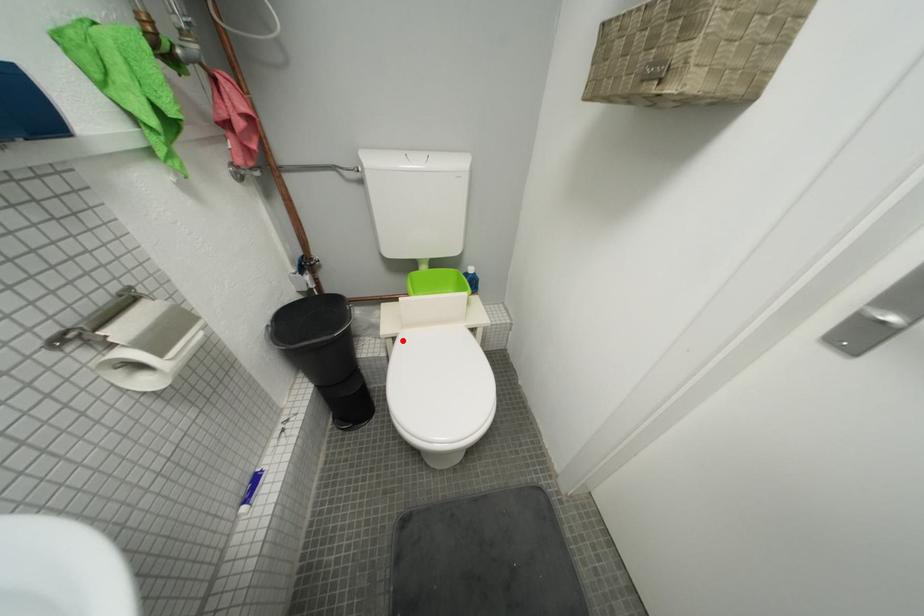
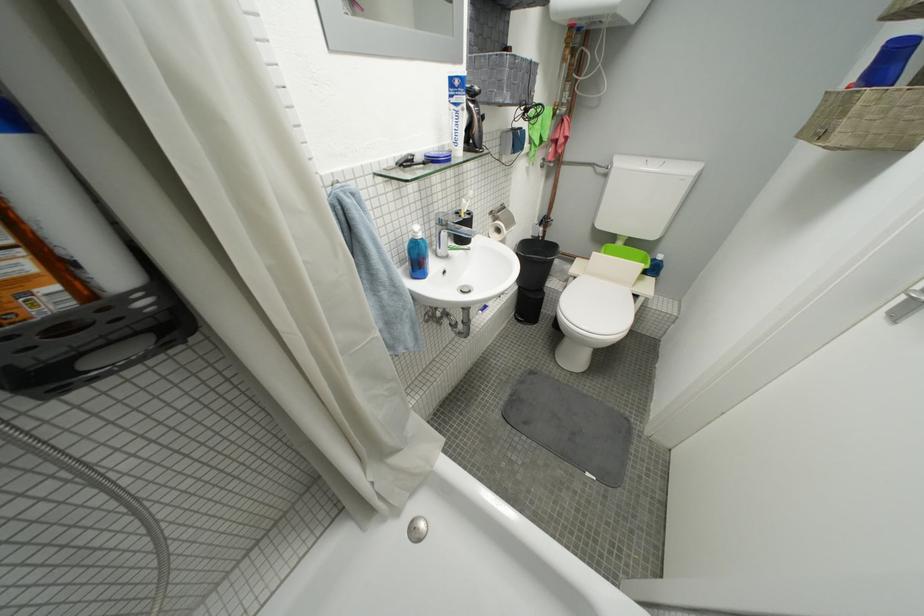
Question: A red point is marked in image1. In image2, is the corresponding 3D point closer to the camera or farther? Reply with the corresponding letter.

Choices:
 (A) The corresponding 3D point is closer.
 (B) The corresponding 3D point is farther.

Answer: (A)